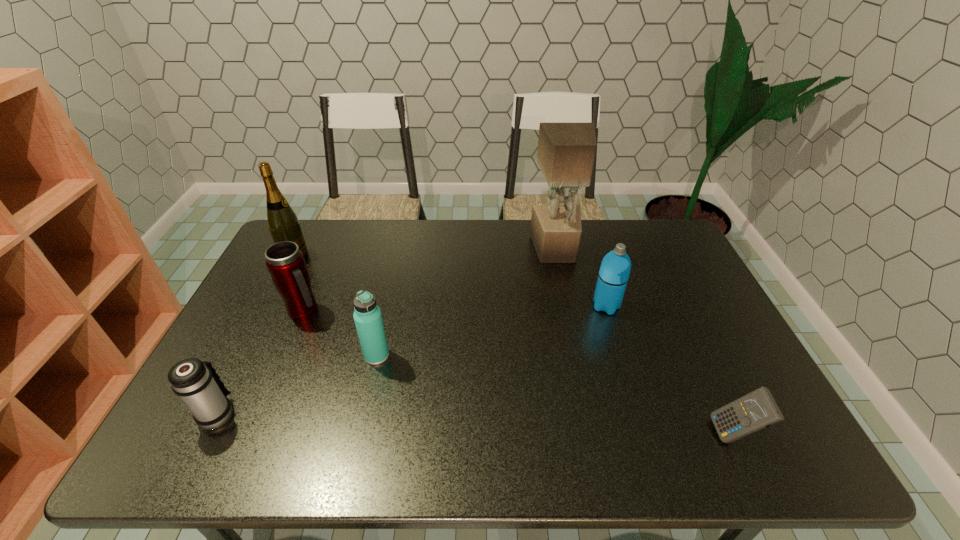
Where is `vacant space that satisfies the following two spatial constraints: 1. on the side with the handle of the shortest thermos bottle; 2. on the front-facing side of the second tallest object`? The width and height of the screenshot is (960, 540). vacant space that satisfies the following two spatial constraints: 1. on the side with the handle of the shortest thermos bottle; 2. on the front-facing side of the second tallest object is located at coordinates (297, 256).

At what (x,y) coordinates should I click in order to perform the action: click on blank space that satisfies the following two spatial constraints: 1. on the side with the handle of the leftmost thermos bottle; 2. on the right side of the third farthest thermos bottle. Please return your answer as a coordinate pair (x, y). This screenshot has height=540, width=960. Looking at the image, I should click on (247, 355).